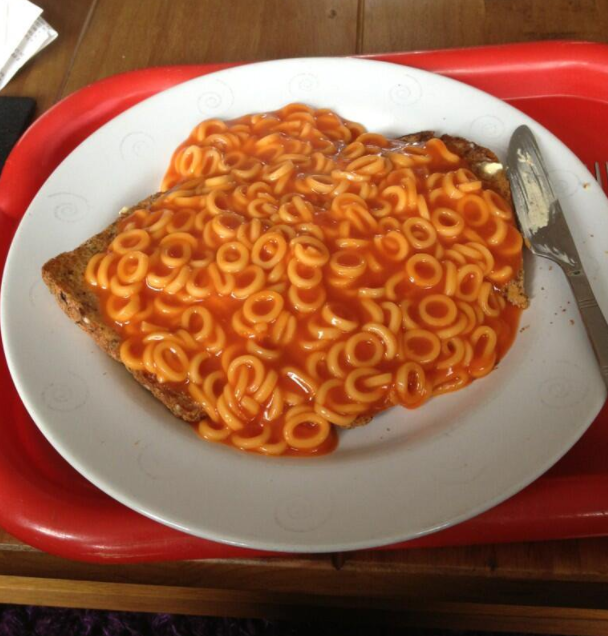
You are a GUI agent. You are given a task and a screenshot of the screen. Output one action in this format:
    pyautogui.click(x=<x>, y=<y>)
    Task: Click on the white plate
    This screenshot has width=608, height=636.
    Given the screenshot: What is the action you would take?
    pyautogui.click(x=319, y=507)